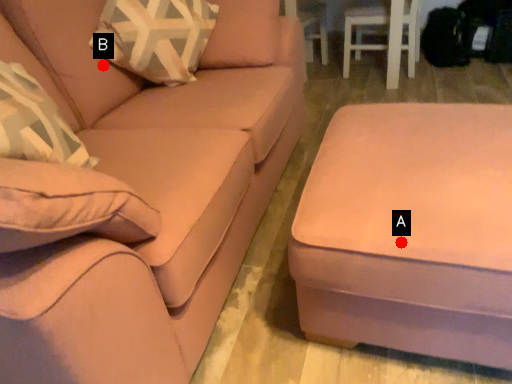
Question: Two points are circled on the image, labeled by A and B beside each circle. Among these points, which one is nearest to the camera?

Choices:
 (A) A is closer
 (B) B is closer

Answer: (A)